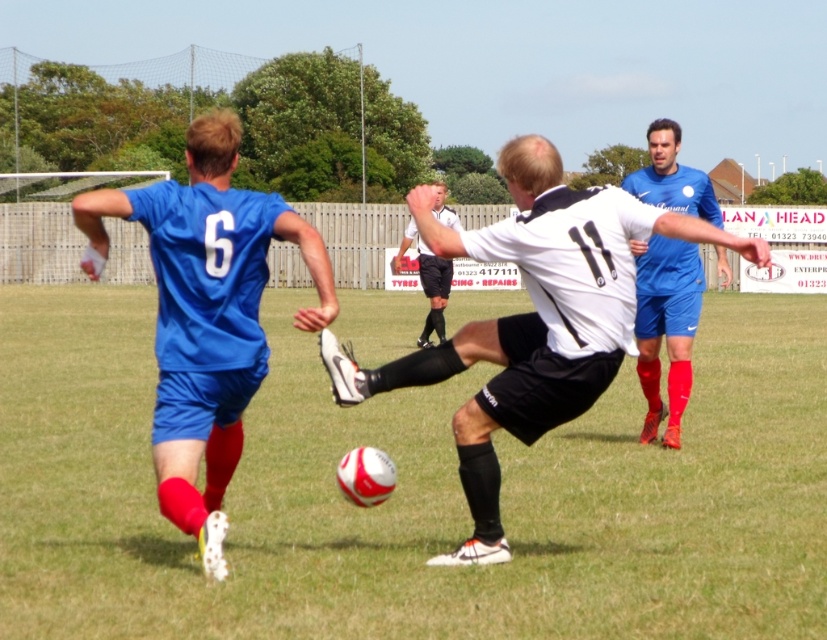
Question: Which of the following is the farthest from the observer?

Choices:
 (A) (705, 227)
 (B) (723, 465)

Answer: (B)

Question: Which is farther from the white matte soccer ball at center?

Choices:
 (A) matte blue jersey at left
 (B) white smooth referee at center
 (C) blue matte soccer player at center
 (D) green grass football field at center

Answer: (D)

Question: Can you confirm if white matte soccer ball at center is positioned to the left of white smooth referee at center?

Choices:
 (A) no
 (B) yes

Answer: (A)

Question: Is matte blue jersey at left closer to camera compared to blue matte soccer player at center?

Choices:
 (A) yes
 (B) no

Answer: (A)

Question: Which point is closer to the camera?

Choices:
 (A) (419, 257)
 (B) (820, 552)

Answer: (B)

Question: Is green grass football field at center thinner than matte blue jersey at left?

Choices:
 (A) yes
 (B) no

Answer: (B)